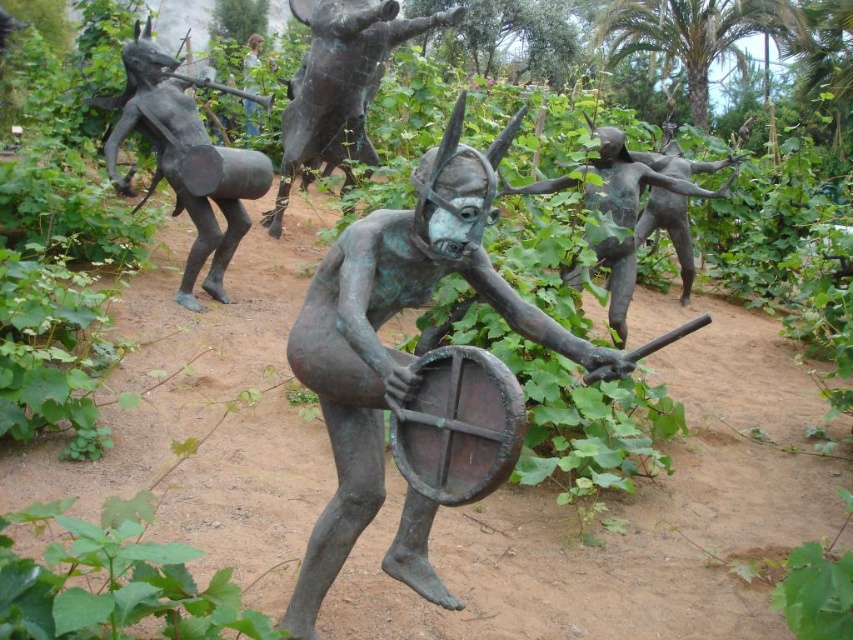
Question: Considering the real-world distances, which object is closest to the bronze drum at upper left?

Choices:
 (A) blue-green bronze figure at center
 (B) green patina bronze figure at center-right
 (C) bronze statue at center
 (D) bronze drum at center

Answer: (D)

Question: Can you confirm if bronze statue at center is bigger than bronze drum at upper left?

Choices:
 (A) no
 (B) yes

Answer: (A)

Question: Which point is closer to the camera taking this photo?

Choices:
 (A) (460, 6)
 (B) (621, 170)
 (C) (160, 147)

Answer: (B)

Question: Can you confirm if bronze drum at center is bigger than green patina bronze figure at center-right?

Choices:
 (A) no
 (B) yes

Answer: (B)

Question: Which of these objects is positioned farthest from the blue-green bronze figure at center?

Choices:
 (A) bronze statue at center
 (B) bronze drum at upper left
 (C) green patina bronze figure at center-right
 (D) bronze drum at center

Answer: (A)

Question: Is bronze drum at upper left smaller than blue-green bronze figure at center?

Choices:
 (A) yes
 (B) no

Answer: (B)